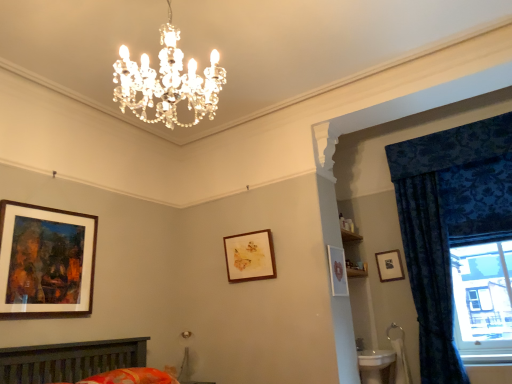
Question: Is wooden-framed painting at left, which ranks as the fourth picture frame in right-to-left order, wider than matte black picture frame at upper right, the first picture frame positioned from the right?

Choices:
 (A) no
 (B) yes

Answer: (B)

Question: Is wooden-framed painting at left, positioned as the 1th picture frame in front-to-back order, touching matte black picture frame at upper right, the 4th picture frame in the front-to-back sequence?

Choices:
 (A) yes
 (B) no

Answer: (B)

Question: Is wooden-framed painting at left, positioned as the 1th picture frame in front-to-back order, bigger than matte black picture frame at upper right, the first picture frame positioned from the right?

Choices:
 (A) yes
 (B) no

Answer: (A)

Question: Is wooden-framed painting at left, which ranks as the fourth picture frame in right-to-left order, not within matte black picture frame at upper right, which is the 1th picture frame from back to front?

Choices:
 (A) yes
 (B) no

Answer: (A)

Question: Is wooden-framed painting at left, positioned as the 1th picture frame in front-to-back order, surrounding matte black picture frame at upper right, the 4th picture frame in the front-to-back sequence?

Choices:
 (A) no
 (B) yes

Answer: (A)

Question: From the image's perspective, is wooden-framed painting at left, which ranks as the first picture frame in left-to-right order, above matte black picture frame at upper right, the 4th picture frame in the front-to-back sequence?

Choices:
 (A) yes
 (B) no

Answer: (A)

Question: From a real-world perspective, is velvet blue curtain at right, acting as the 2th curtain starting from the right, beneath wooden-framed painting at left, which ranks as the fourth picture frame in right-to-left order?

Choices:
 (A) yes
 (B) no

Answer: (A)

Question: Can you confirm if velvet blue curtain at right, acting as the 2th curtain starting from the right, is smaller than wooden-framed painting at left, which ranks as the first picture frame in left-to-right order?

Choices:
 (A) yes
 (B) no

Answer: (B)

Question: Is velvet blue curtain at right, acting as the 2th curtain starting from the right, wider than wooden-framed painting at left, which ranks as the first picture frame in left-to-right order?

Choices:
 (A) yes
 (B) no

Answer: (A)

Question: Is the position of velvet blue curtain at right, which is counted as the 1th curtain, starting from the left, more distant than that of wooden-framed painting at left, which ranks as the first picture frame in left-to-right order?

Choices:
 (A) no
 (B) yes

Answer: (B)

Question: Is velvet blue curtain at right, acting as the 2th curtain starting from the right, to the left of wooden-framed painting at left, positioned as the 1th picture frame in front-to-back order, from the viewer's perspective?

Choices:
 (A) no
 (B) yes

Answer: (A)

Question: Is velvet blue curtain at right, acting as the 2th curtain starting from the right, located outside wooden-framed painting at left, positioned as the 1th picture frame in front-to-back order?

Choices:
 (A) yes
 (B) no

Answer: (A)

Question: Is wooden-framed painting at left, positioned as the 1th picture frame in front-to-back order, positioned with its back to floral cotton bedspread at lower center?

Choices:
 (A) yes
 (B) no

Answer: (B)